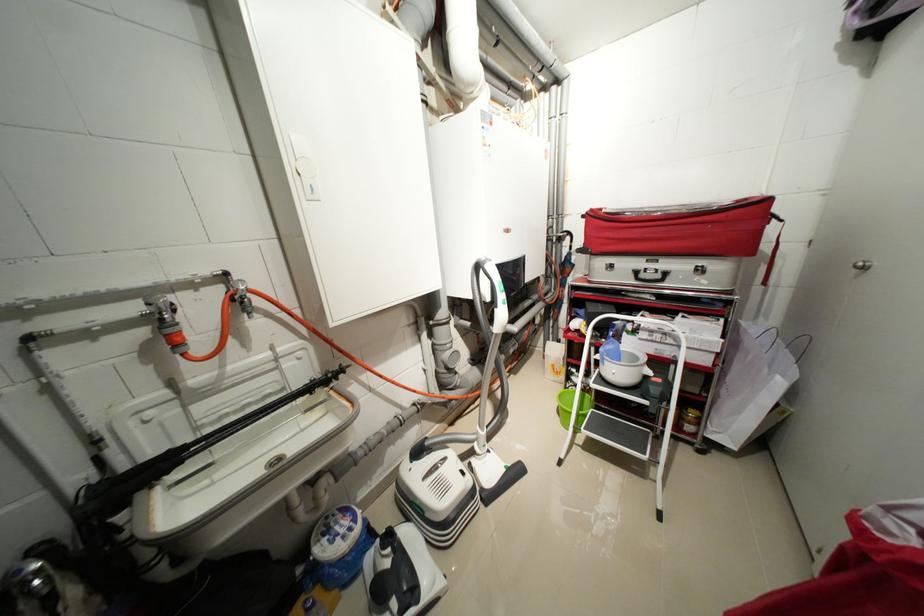
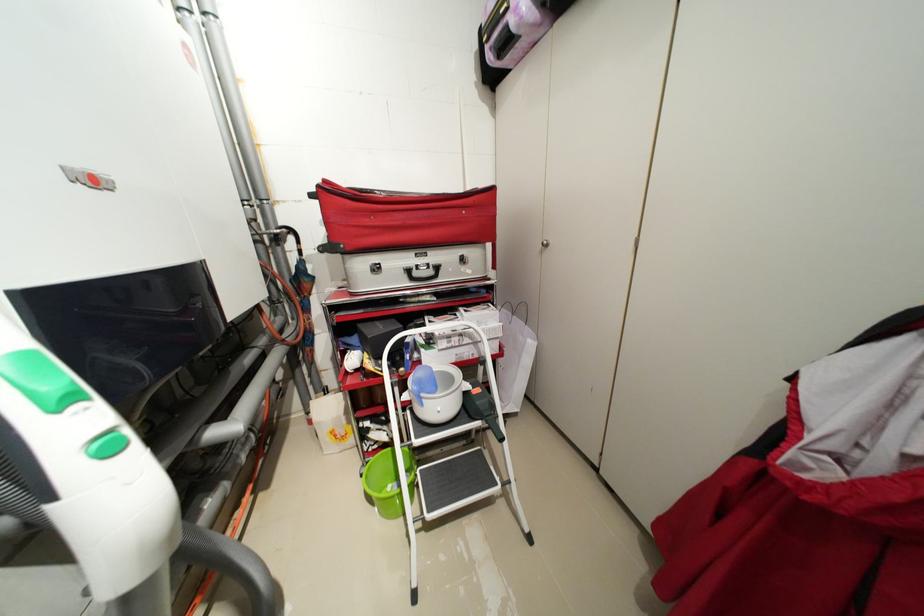
The point at (x=599, y=211) is marked in the first image. Where is the corresponding point in the second image?

(332, 182)